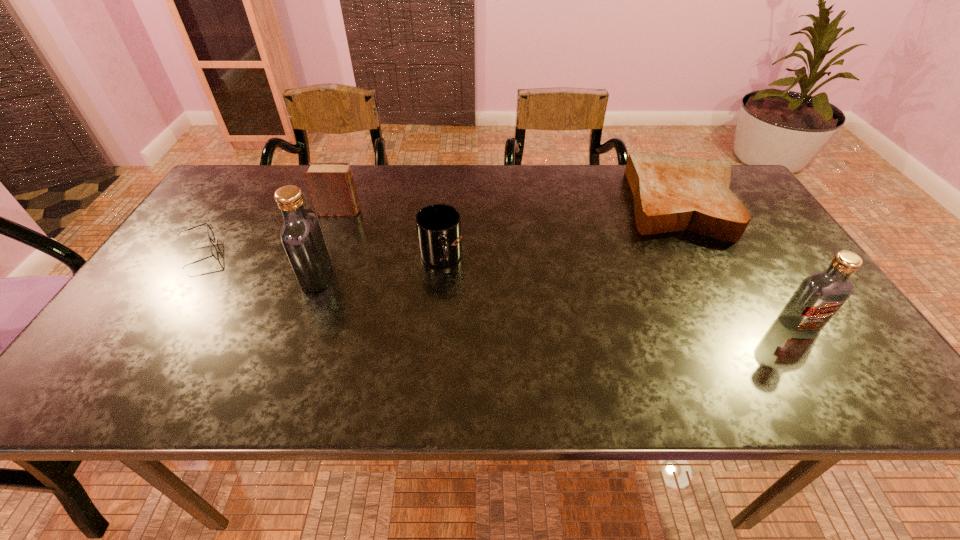
Locate which object ranks in proximity to the nearer vodka. Please provide its 2D coordinates. Your answer should be formatted as a tuple, i.e. [(x, y)], where the tuple contains the x and y coordinates of a point satisfying the conditions above.

[(671, 193)]